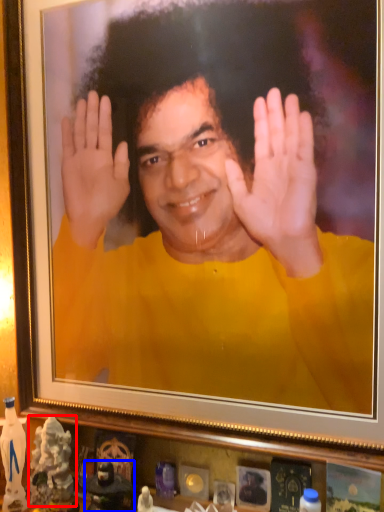
Question: Which object is closer to the camera taking this photo, toy (highlighted by a red box) or toy (highlighted by a blue box)?

Choices:
 (A) toy
 (B) toy

Answer: (B)